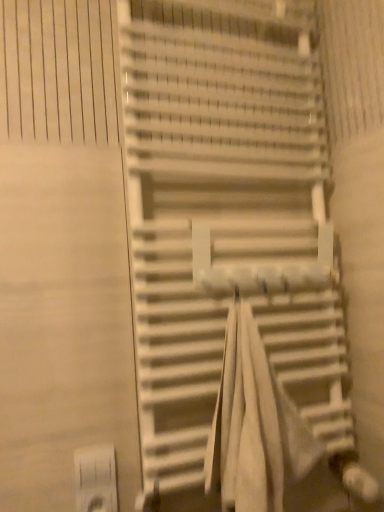
Locate an element on the screen. This screenshot has width=384, height=512. white fabric beach towel at center is located at coordinates (254, 425).

Where is `white fabric beach towel at center`? The image size is (384, 512). white fabric beach towel at center is located at coordinates (254, 425).

Locate an element on the screen. beach towel located on the right of white plastic electric outlet at lower left is located at coordinates (254, 425).

From the picture: Is white fabric beach towel at center oriented away from white plastic electric outlet at lower left?

No, white fabric beach towel at center is not facing the opposite direction of white plastic electric outlet at lower left.

Is white fabric beach towel at center wider or thinner than white plastic electric outlet at lower left?

In the image, white fabric beach towel at center appears to be wider than white plastic electric outlet at lower left.

Considering the positions of objects white fabric beach towel at center and white plastic electric outlet at lower left in the image provided, who is in front, white fabric beach towel at center or white plastic electric outlet at lower left?

white fabric beach towel at center is closer to the camera.

Is white plastic electric outlet at lower left to the left of white matte stairs at center from the viewer's perspective?

Yes, white plastic electric outlet at lower left is to the left of white matte stairs at center.

There is a white plastic electric outlet at lower left. At what (x,y) coordinates should I click in order to perform the action: click on stairs above it (from a real-world perspective). Please return your answer as a coordinate pair (x, y). Looking at the image, I should click on (226, 220).

From the image's perspective, would you say white plastic electric outlet at lower left is shown under white matte stairs at center?

Correct, white plastic electric outlet at lower left appears lower than white matte stairs at center in the image.

Does white plastic electric outlet at lower left turn towards white matte stairs at center?

No, white plastic electric outlet at lower left is not oriented towards white matte stairs at center.

How much distance is there between white plastic electric outlet at lower left and white fabric beach towel at center?

The distance of white plastic electric outlet at lower left from white fabric beach towel at center is 12.34 inches.

Considering the sizes of white plastic electric outlet at lower left and white fabric beach towel at center in the image, is white plastic electric outlet at lower left taller or shorter than white fabric beach towel at center?

In the image, white plastic electric outlet at lower left appears to be shorter than white fabric beach towel at center.

Considering the relative positions of white plastic electric outlet at lower left and white fabric beach towel at center in the image provided, is white plastic electric outlet at lower left to the right of white fabric beach towel at center from the viewer's perspective?

In fact, white plastic electric outlet at lower left is to the left of white fabric beach towel at center.

Between point (115, 490) and point (234, 393), which one is positioned in front?

Point (234, 393)

What's the angular difference between white matte stairs at center and white fabric beach towel at center's facing directions?

0.000328 degrees separate the facing orientations of white matte stairs at center and white fabric beach towel at center.

Is the position of white matte stairs at center less distant than that of white fabric beach towel at center?

That is False.

Would you say white fabric beach towel at center is part of white matte stairs at center's contents?

Indeed, white fabric beach towel at center is located within white matte stairs at center.

Between white matte stairs at center and white plastic electric outlet at lower left, which one has more height?

Standing taller between the two is white matte stairs at center.

Where is `electric outlet that is below the white matte stairs at center (from the image's perspective)`? The width and height of the screenshot is (384, 512). electric outlet that is below the white matte stairs at center (from the image's perspective) is located at coordinates (96, 478).

Is white matte stairs at center not near white plastic electric outlet at lower left?

No.

Can white plastic electric outlet at lower left be found inside white matte stairs at center?

Actually, white plastic electric outlet at lower left is outside white matte stairs at center.

Is white fabric beach towel at center smaller than white matte stairs at center?

Indeed, white fabric beach towel at center has a smaller size compared to white matte stairs at center.

Could you tell me if white fabric beach towel at center is turned towards white matte stairs at center?

Yes, white fabric beach towel at center is oriented towards white matte stairs at center.

From the image's perspective, is white fabric beach towel at center over white matte stairs at center?

No, from the image's perspective, white fabric beach towel at center is not on top of white matte stairs at center.

From a real-world perspective, which object stands above the other?

white matte stairs at center.

Where is `beach towel on the right side of white plastic electric outlet at lower left`? This screenshot has width=384, height=512. beach towel on the right side of white plastic electric outlet at lower left is located at coordinates [254, 425].

In order to click on electric outlet on the left of white matte stairs at center in this screenshot , I will do `click(96, 478)`.

Estimate the real-world distances between objects in this image. Which object is further from white plastic electric outlet at lower left, white matte stairs at center or white fabric beach towel at center?

white matte stairs at center lies further to white plastic electric outlet at lower left than the other object.

Based on their spatial positions, is white fabric beach towel at center or white matte stairs at center closer to white plastic electric outlet at lower left?

white fabric beach towel at center lies closer to white plastic electric outlet at lower left than the other object.

Considering their positions, is white plastic electric outlet at lower left positioned further to white fabric beach towel at center than white matte stairs at center?

white plastic electric outlet at lower left is positioned further to the anchor white fabric beach towel at center.

Based on their spatial positions, is white fabric beach towel at center or white plastic electric outlet at lower left further from white matte stairs at center?

The object further to white matte stairs at center is white plastic electric outlet at lower left.

Considering their positions, is white matte stairs at center positioned further to white fabric beach towel at center than white plastic electric outlet at lower left?

white plastic electric outlet at lower left is further to white fabric beach towel at center.

In the scene shown: Looking at the image, which one is located closer to white matte stairs at center, white plastic electric outlet at lower left or white fabric beach towel at center?

white fabric beach towel at center is positioned closer to the anchor white matte stairs at center.

Image resolution: width=384 pixels, height=512 pixels. What are the coordinates of `beach towel that lies between white matte stairs at center and white plastic electric outlet at lower left from top to bottom` in the screenshot? It's located at (254, 425).